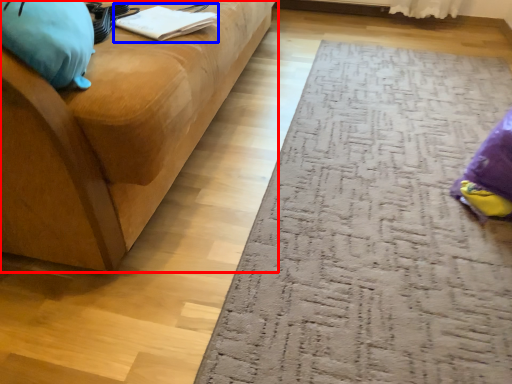
Question: Which object is closer to the camera taking this photo, studio couch (highlighted by a red box) or book (highlighted by a blue box)?

Choices:
 (A) studio couch
 (B) book

Answer: (A)